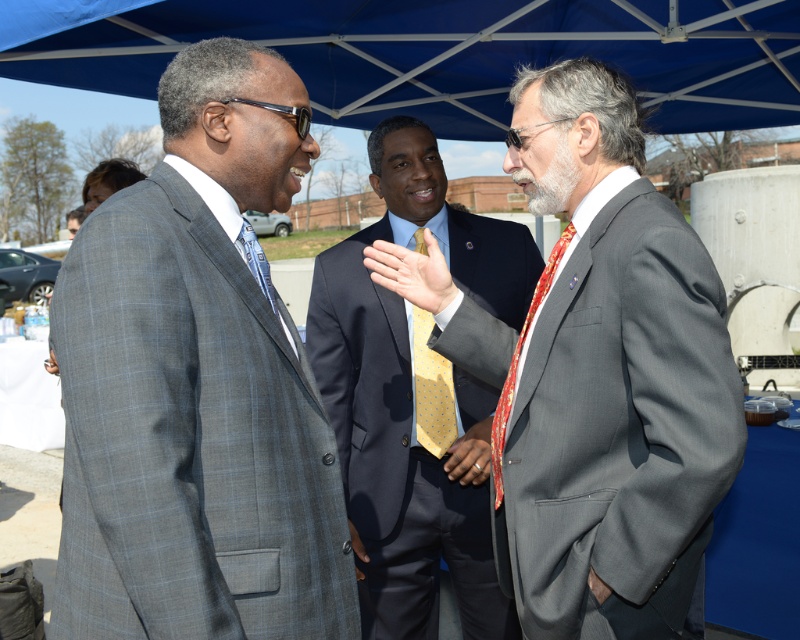
Based on the photo, you are standing at the point with coordinates point (425,292) and want to move to the point with coordinates point (660,260). Is the destination point in front of or behind you?

The destination point point (660,260) is in front of the starting point point (425,292), so it is in front of you.

You are standing at the origin point in the image. Which object among the gray checkered suit at center is closer to you?

The gray checkered suit at center is located at point (197, 385), so it is closer to you than the other objects in the scene.

You are standing at the origin point in the image. Which direction should you move to reach the gray checkered suit at center?

The gray checkered suit at center is located at coordinates point [197,385], so you should move northeast to reach it.